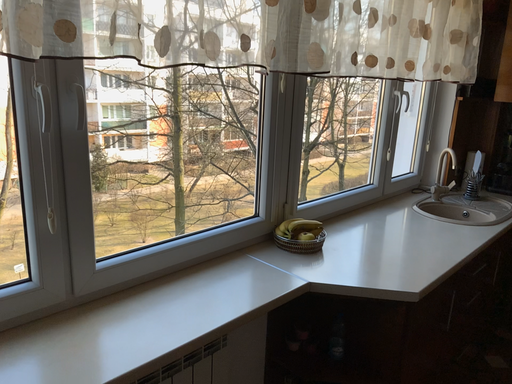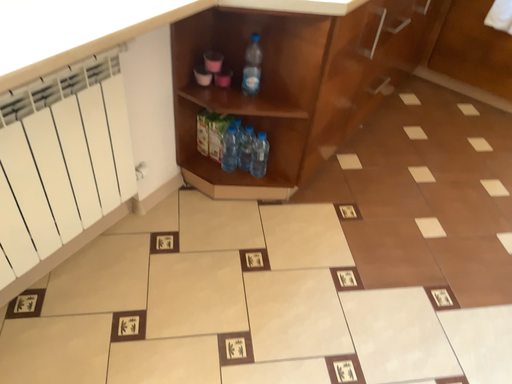
Question: Which way did the camera rotate in the video?

Choices:
 (A) rotated downward
 (B) rotated upward

Answer: (A)